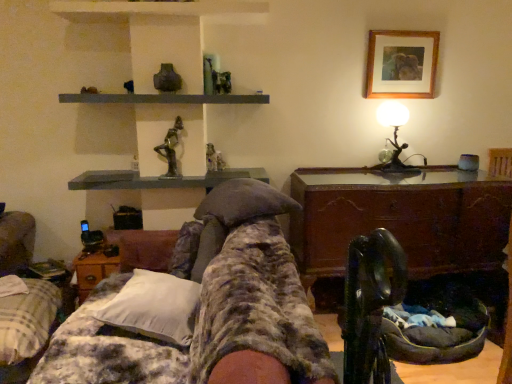
Question: From a real-world perspective, is matte gray figurine at center above or below white soft pillow at center?

Choices:
 (A) above
 (B) below

Answer: (A)

Question: Based on their positions, is matte gray figurine at center located to the left or right of white soft pillow at center?

Choices:
 (A) left
 (B) right

Answer: (B)

Question: Estimate the real-world distances between objects in this image. Which object is farther from the plaid fabric bedspread at lower left, the second furniture positioned from the right?

Choices:
 (A) fluffy fabric blanket at center, arranged as the 1th furniture when viewed from the right
 (B) white soft pillow at center
 (C) woodenmaterial/texturetable at lower left, acting as the 1th table starting from the left
 (D) metallic silver table lamp at upper right
 (E) matte gray figurine at center

Answer: (D)

Question: Estimate the real-world distances between objects in this image. Which object is farther from the bronze statue at upper center?

Choices:
 (A) fluffy fabric blanket at center, marked as the second furniture in a left-to-right arrangement
 (B) plaid fabric bedspread at lower left, acting as the first furniture starting from the left
 (C) matte gray figurine at center
 (D) wooden picture frame at upper right
 (E) metallic silver table lamp at upper right

Answer: (D)